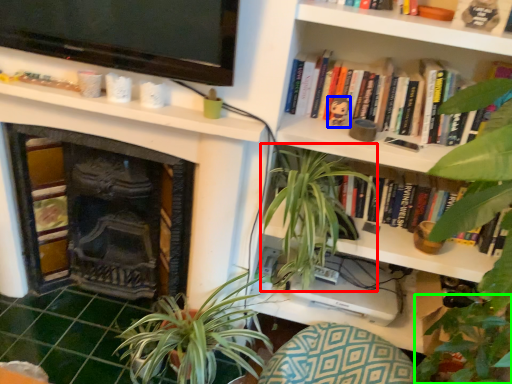
Question: Which object is positioned closest to vegetation (highlighted by a red box)? Select from toy (highlighted by a blue box) and vegetation (highlighted by a green box).

Choices:
 (A) toy
 (B) vegetation

Answer: (A)